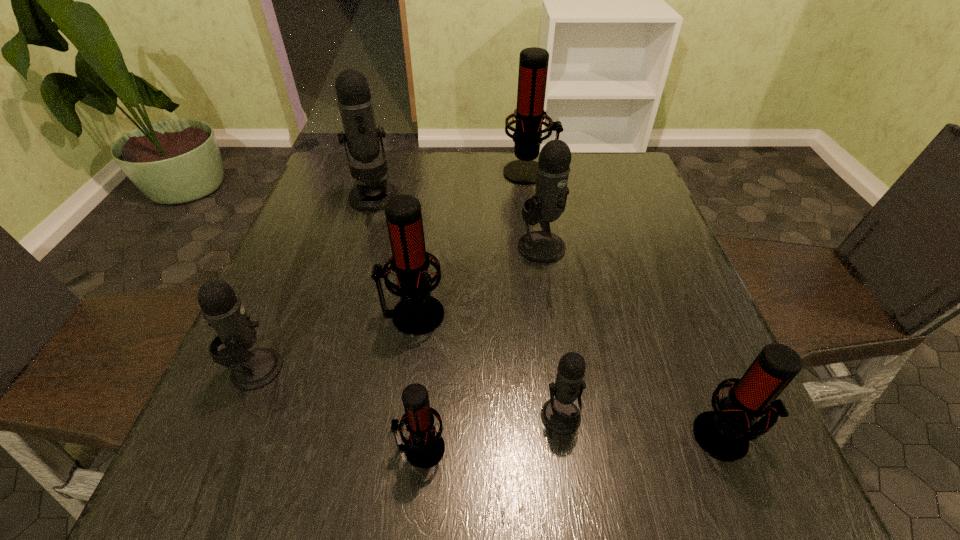
The width and height of the screenshot is (960, 540). I want to click on object that can be found as the fourth closest to the nearest black microphone, so click(x=553, y=168).

Choose which object is the nearest neighbor to the second farthest black microphone. Please provide its 2D coordinates. Your answer should be formatted as a tuple, i.e. [(x, y)], where the tuple contains the x and y coordinates of a point satisfying the conditions above.

[(418, 313)]

This screenshot has width=960, height=540. I want to click on microphone that is the fifth closest to the rightmost object, so click(x=533, y=63).

This screenshot has width=960, height=540. Identify the location of the third closest microphone to the farthest red microphone. (418, 313).

Locate which red microphone is the third closest to the fifth nearest microphone. Please provide its 2D coordinates. Your answer should be formatted as a tuple, i.e. [(x, y)], where the tuple contains the x and y coordinates of a point satisfying the conditions above.

[(724, 433)]

Select which red microphone is the third closest to the third smallest black microphone. Please provide its 2D coordinates. Your answer should be formatted as a tuple, i.e. [(x, y)], where the tuple contains the x and y coordinates of a point satisfying the conditions above.

[(724, 433)]

The height and width of the screenshot is (540, 960). What are the coordinates of `black microphone that is the closest to the seventh microphone from right to left` in the screenshot? It's located at (553, 168).

The height and width of the screenshot is (540, 960). I want to click on the third closest black microphone to the fourth nearest microphone, so click(x=553, y=168).

You are a GUI agent. You are given a task and a screenshot of the screen. Output one action in this format:
    pyautogui.click(x=<x>, y=<y>)
    Task: Click on the vacant space that satisfies the following two spatial constraints: 1. on the back side of the biggest red microphone; 2. on the right side of the second smallest black microphone
    The width and height of the screenshot is (960, 540).
    Given the screenshot: What is the action you would take?
    pyautogui.click(x=338, y=172)